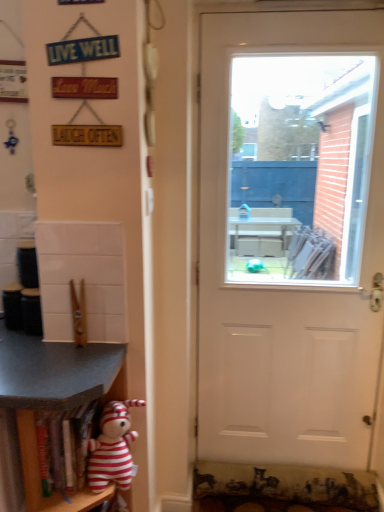
Measure the distance between striped plush toy at lower left and camera.

striped plush toy at lower left and camera are 1.29 meters apart from each other.

What do you see at coordinates (290, 237) in the screenshot? I see `white matte door at center` at bounding box center [290, 237].

In the scene shown: In order to face wooden bookshelf at lower left, the 1th shelf viewed from the right, should I rotate leftwards or rightwards?

Turn left by 16.071 degrees to look at wooden bookshelf at lower left, the 1th shelf viewed from the right.

Find the location of `wooden shelf at lower left, the second shelf from the right`. wooden shelf at lower left, the second shelf from the right is located at coordinates (54, 397).

You are a GUI agent. You are given a task and a screenshot of the screen. Output one action in this format:
    pyautogui.click(x=<x>, y=<y>)
    Task: Click on the striped plush toy at lower left
    
    Given the screenshot: What is the action you would take?
    pyautogui.click(x=112, y=447)

From a real-world perspective, does wooden bookshelf at lower left, the 1th shelf viewed from the right, stand above white matte door at center?

Actually, wooden bookshelf at lower left, the 1th shelf viewed from the right, is physically below white matte door at center in the real world.

Does point (33, 483) lie behind point (242, 318)?

That is False.

Is wooden bookshelf at lower left, the 1th shelf viewed from the right, positioned with its back to white matte door at center?

No, wooden bookshelf at lower left, the 1th shelf viewed from the right,'s orientation is not away from white matte door at center.

Could white matte door at center be considered to be inside wooden bookshelf at lower left, arranged as the second shelf when viewed from the left?

Definitely not — white matte door at center is not inside wooden bookshelf at lower left, arranged as the second shelf when viewed from the left.

Is wooden bookshelf at lower left, the 1th shelf viewed from the right, placed right next to wooden shelf at lower left, which appears as the 1th shelf when viewed from the left?

wooden bookshelf at lower left, the 1th shelf viewed from the right, is not next to wooden shelf at lower left, which appears as the 1th shelf when viewed from the left, and they're not touching.

Does wooden bookshelf at lower left, arranged as the second shelf when viewed from the left, lie in front of wooden shelf at lower left, which appears as the 1th shelf when viewed from the left?

No, it is not.

Does point (27, 416) come farther from viewer compared to point (27, 398)?

That is True.

Which object is positioned more to the left, wooden bookshelf at lower left, the 1th shelf viewed from the right, or wooden shelf at lower left, the second shelf from the right?

wooden shelf at lower left, the second shelf from the right.

Does point (9, 388) come closer to viewer compared to point (41, 489)?

Yes, point (9, 388) is closer to viewer.

This screenshot has height=512, width=384. Identify the location of shelf above the wooden shelf at lower left, which appears as the 1th shelf when viewed from the left (from the image's perspective). (40, 476).

Is the surface of wooden shelf at lower left, the second shelf from the right, in direct contact with wooden bookshelf at lower left, the 1th shelf viewed from the right?

No, wooden shelf at lower left, the second shelf from the right, is not beside wooden bookshelf at lower left, the 1th shelf viewed from the right.

Which object is closer to the camera, wooden shelf at lower left, the second shelf from the right, or wooden bookshelf at lower left, arranged as the second shelf when viewed from the left?

Positioned in front is wooden shelf at lower left, the second shelf from the right.

Is wooden shelf at lower left, which appears as the 1th shelf when viewed from the left, inside striped plush toy at lower left?

That's incorrect, wooden shelf at lower left, which appears as the 1th shelf when viewed from the left, is not inside striped plush toy at lower left.

Which point is more distant from viewer, (93, 464) or (39, 406)?

The point (93, 464) is farther.

Is striped plush toy at lower left facing away from wooden shelf at lower left, which appears as the 1th shelf when viewed from the left?

Correct, striped plush toy at lower left is looking away from wooden shelf at lower left, which appears as the 1th shelf when viewed from the left.

Which of these two, striped plush toy at lower left or wooden shelf at lower left, the second shelf from the right, stands shorter?

Standing shorter between the two is striped plush toy at lower left.

Which of these two, striped plush toy at lower left or white matte door at center, stands shorter?

striped plush toy at lower left.

Is striped plush toy at lower left wider than white matte door at center?

Yes, striped plush toy at lower left is wider than white matte door at center.

Considering their positions, is striped plush toy at lower left located in front of or behind white matte door at center?

striped plush toy at lower left is in front of white matte door at center.

From a real-world perspective, is striped plush toy at lower left positioned above or below white matte door at center?

From a real-world perspective, striped plush toy at lower left is physically below white matte door at center.

From a real-world perspective, is striped plush toy at lower left positioned above or below wooden bookshelf at lower left, the 1th shelf viewed from the right?

striped plush toy at lower left is situated lower than wooden bookshelf at lower left, the 1th shelf viewed from the right, in the real world.

You are a GUI agent. You are given a task and a screenshot of the screen. Output one action in this format:
    pyautogui.click(x=<x>, y=<y>)
    Task: Click on the shelf above the striped plush toy at lower left (from a real-world perspective)
    This screenshot has width=384, height=512.
    Given the screenshot: What is the action you would take?
    pyautogui.click(x=40, y=476)

Are striped plush toy at lower left and wooden bookshelf at lower left, arranged as the second shelf when viewed from the left, located far from each other?

No, striped plush toy at lower left is in close proximity to wooden bookshelf at lower left, arranged as the second shelf when viewed from the left.

Is striped plush toy at lower left aimed at wooden bookshelf at lower left, the 1th shelf viewed from the right?

No, striped plush toy at lower left is not turned towards wooden bookshelf at lower left, the 1th shelf viewed from the right.

Locate an element on the screen. The image size is (384, 512). toy that is in front of the white matte door at center is located at coordinates (112, 447).

Is white matte door at center positioned behind striped plush toy at lower left?

Yes, it is.

Consider the image. Can you confirm if white matte door at center is shorter than striped plush toy at lower left?

Incorrect, the height of white matte door at center does not fall short of that of striped plush toy at lower left.

Which shelf is the 1st one when counting from the left side of the white matte door at center? Please provide its 2D coordinates.

[(40, 476)]

At what (x,y) coordinates should I click in order to perform the action: click on shelf that is above the wooden shelf at lower left, which appears as the 1th shelf when viewed from the left (from a real-world perspective). Please return your answer as a coordinate pair (x, y). The height and width of the screenshot is (512, 384). Looking at the image, I should click on coord(40,476).

Which object lies nearer to the anchor point white matte door at center, wooden bookshelf at lower left, the 1th shelf viewed from the right, or wooden shelf at lower left, the second shelf from the right?

wooden shelf at lower left, the second shelf from the right, is closer to white matte door at center.

When comparing their distances from wooden shelf at lower left, which appears as the 1th shelf when viewed from the left, does wooden bookshelf at lower left, the 1th shelf viewed from the right, or white matte door at center seem further?

white matte door at center is further to wooden shelf at lower left, which appears as the 1th shelf when viewed from the left.

From the image, which object appears to be nearer to white matte door at center, striped plush toy at lower left or wooden bookshelf at lower left, the 1th shelf viewed from the right?

Based on the image, striped plush toy at lower left appears to be nearer to white matte door at center.

Estimate the real-world distances between objects in this image. Which object is further from striped plush toy at lower left, wooden shelf at lower left, which appears as the 1th shelf when viewed from the left, or white matte door at center?

white matte door at center.

Considering their positions, is wooden shelf at lower left, the second shelf from the right, positioned closer to white matte door at center than striped plush toy at lower left?

wooden shelf at lower left, the second shelf from the right, lies closer to white matte door at center than the other object.

From the picture: Based on their spatial positions, is wooden bookshelf at lower left, the 1th shelf viewed from the right, or striped plush toy at lower left closer to wooden shelf at lower left, which appears as the 1th shelf when viewed from the left?

Based on the image, wooden bookshelf at lower left, the 1th shelf viewed from the right, appears to be nearer to wooden shelf at lower left, which appears as the 1th shelf when viewed from the left.

Based on their spatial positions, is wooden shelf at lower left, which appears as the 1th shelf when viewed from the left, or wooden bookshelf at lower left, arranged as the second shelf when viewed from the left, further from striped plush toy at lower left?

wooden shelf at lower left, which appears as the 1th shelf when viewed from the left.

Looking at the image, which one is located closer to striped plush toy at lower left, wooden bookshelf at lower left, arranged as the second shelf when viewed from the left, or wooden shelf at lower left, which appears as the 1th shelf when viewed from the left?

Based on the image, wooden bookshelf at lower left, arranged as the second shelf when viewed from the left, appears to be nearer to striped plush toy at lower left.

Find the location of `toy between wooden shelf at lower left, which appears as the 1th shelf when viewed from the left, and white matte door at center from left to right`. toy between wooden shelf at lower left, which appears as the 1th shelf when viewed from the left, and white matte door at center from left to right is located at coordinates (112, 447).

In order to click on shelf between wooden shelf at lower left, the second shelf from the right, and striped plush toy at lower left, in the horizontal direction in this screenshot , I will do `click(40, 476)`.

Locate an element on the screen. The image size is (384, 512). toy between wooden bookshelf at lower left, the 1th shelf viewed from the right, and white matte door at center, in the horizontal direction is located at coordinates (112, 447).

I want to click on shelf between wooden shelf at lower left, which appears as the 1th shelf when viewed from the left, and white matte door at center, in the horizontal direction, so click(x=40, y=476).